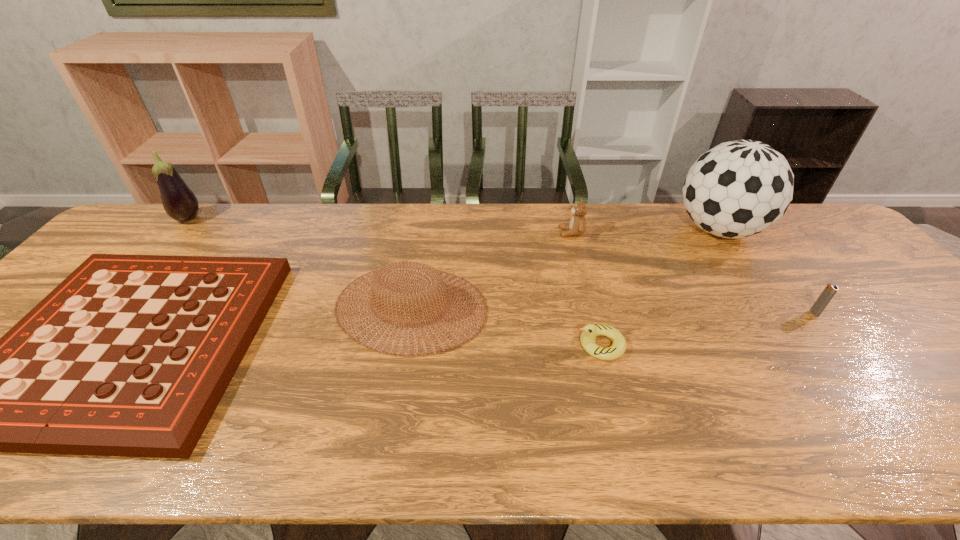
Where is `soccer ball`? soccer ball is located at coordinates (740, 188).

I want to click on the sixth shortest object, so click(180, 203).

The image size is (960, 540). In order to click on teddy bear in this screenshot , I will do `click(577, 226)`.

Identify the location of sunhat. (376, 282).

Find the location of a particular element. igniter is located at coordinates [x=830, y=290].

The width and height of the screenshot is (960, 540). Find the location of `duckling`. duckling is located at coordinates (589, 332).

Identify the location of vacant region located on the left of the soccer ball. The width and height of the screenshot is (960, 540). (652, 230).

You are a GUI agent. You are given a task and a screenshot of the screen. Output one action in this format:
    pyautogui.click(x=<x>, y=<y>)
    Task: Click on the vacant space located on the front of the second tallest object
    
    Given the screenshot: What is the action you would take?
    pyautogui.click(x=136, y=281)

You are a GUI agent. You are given a task and a screenshot of the screen. Output one action in this format:
    pyautogui.click(x=<x>, y=<y>)
    Task: Click on the free space located 0.070m on the front-facing side of the teddy bear
    This screenshot has width=960, height=540.
    Given the screenshot: What is the action you would take?
    pyautogui.click(x=537, y=233)

Locate an element on the screen. vacant space situated on the front-facing side of the teddy bear is located at coordinates (502, 233).